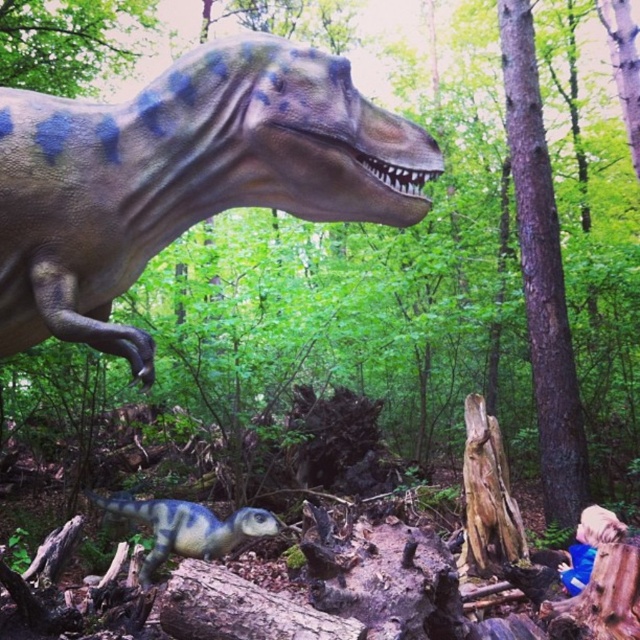
Is shiny metallic dinosaur at upper center bigger than blue-green textured dinosaur at lower center?

Correct, shiny metallic dinosaur at upper center is larger in size than blue-green textured dinosaur at lower center.

Who is positioned more to the left, shiny metallic dinosaur at upper center or blue-green textured dinosaur at lower center?

Positioned to the left is blue-green textured dinosaur at lower center.

Is point (349, 145) in front of point (232, 515)?

Yes, point (349, 145) is in front of point (232, 515).

Locate an element on the screen. The height and width of the screenshot is (640, 640). shiny metallic dinosaur at upper center is located at coordinates (182, 177).